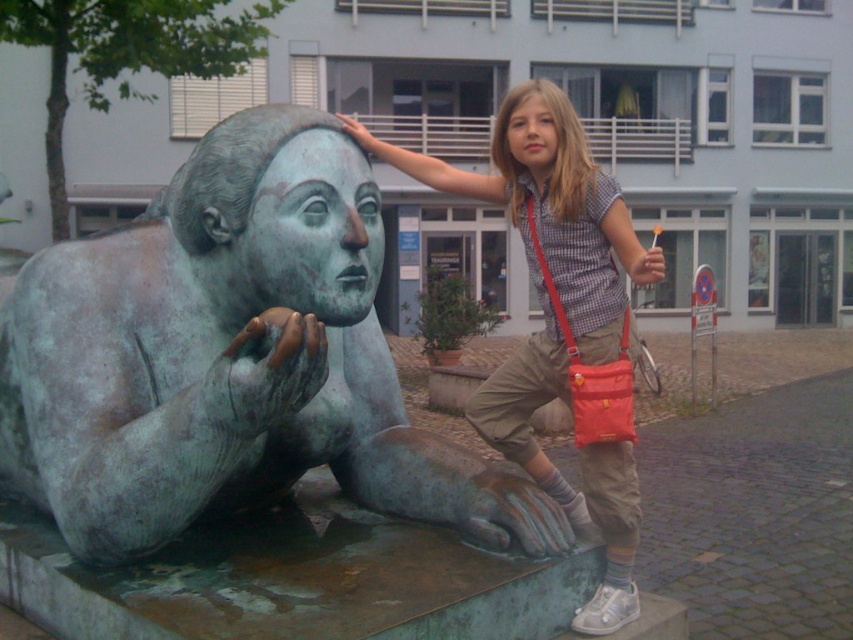
Looking at this image, between green patina statue at center and matte bronze statue at center, which one is positioned lower?

green patina statue at center is below.

Does point (100, 408) come in front of point (584, 609)?

Yes, it is.

You are a GUI agent. You are given a task and a screenshot of the screen. Output one action in this format:
    pyautogui.click(x=<x>, y=<y>)
    Task: Click on the green patina statue at center
    This screenshot has width=853, height=640.
    Given the screenshot: What is the action you would take?
    pyautogui.click(x=230, y=356)